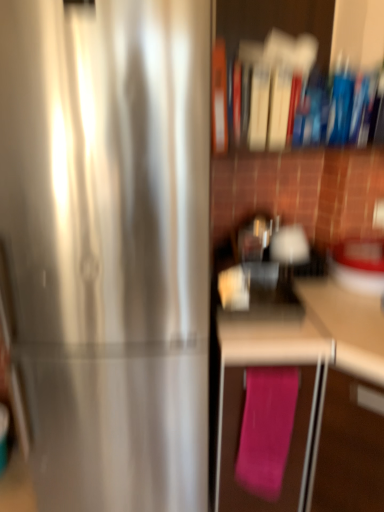
This screenshot has height=512, width=384. What do you see at coordinates (107, 248) in the screenshot? I see `satin silver refrigerator at left` at bounding box center [107, 248].

Image resolution: width=384 pixels, height=512 pixels. In order to click on pink fabric bath towel at lower right in this screenshot , I will do `click(266, 429)`.

Where is `satin silver refrigerator at left`? satin silver refrigerator at left is located at coordinates (107, 248).

Which object is wider, pink fabric bath towel at lower right or satin silver refrigerator at left?

satin silver refrigerator at left is wider.

Consider the image. Is pink fabric bath towel at lower right at the right side of satin silver refrigerator at left?

Indeed, pink fabric bath towel at lower right is positioned on the right side of satin silver refrigerator at left.

Are pink fabric bath towel at lower right and satin silver refrigerator at left beside each other?

pink fabric bath towel at lower right and satin silver refrigerator at left are clearly separated.

Which object is more forward, pink fabric bath towel at lower right or satin silver refrigerator at left?

satin silver refrigerator at left is closer to the camera.

Does pink fabric at lower right lie behind satin silver refrigerator at left?

No, pink fabric at lower right is in front of satin silver refrigerator at left.

Considering the sizes of objects pink fabric at lower right and satin silver refrigerator at left in the image provided, who is shorter, pink fabric at lower right or satin silver refrigerator at left?

pink fabric at lower right is shorter.

Based on the photo, from a real-world perspective, who is located lower, pink fabric at lower right or satin silver refrigerator at left?

pink fabric at lower right is physically lower.

Which is correct: pink fabric at lower right is inside satin silver refrigerator at left, or outside of it?

The correct answer is: outside.

Which is in front, satin silver refrigerator at left or pink fabric bath towel at lower right?

satin silver refrigerator at left is closer to the camera.

Considering the relative sizes of satin silver refrigerator at left and pink fabric bath towel at lower right in the image provided, is satin silver refrigerator at left taller than pink fabric bath towel at lower right?

Indeed, satin silver refrigerator at left has a greater height compared to pink fabric bath towel at lower right.

How far apart are satin silver refrigerator at left and pink fabric bath towel at lower right?

satin silver refrigerator at left and pink fabric bath towel at lower right are 15.99 inches apart from each other.

From a real-world perspective, which object stands above the other?

satin silver refrigerator at left is physically above.

Considering the sizes of pink fabric at lower right and pink fabric bath towel at lower right in the image, is pink fabric at lower right taller or shorter than pink fabric bath towel at lower right?

Considering their sizes, pink fabric at lower right has more height than pink fabric bath towel at lower right.

From the image's perspective, who appears lower, pink fabric at lower right or pink fabric bath towel at lower right?

pink fabric at lower right appears lower in the image.

From a real-world perspective, is pink fabric at lower right on top of pink fabric bath towel at lower right?

No, from a real-world perspective, pink fabric at lower right is not above pink fabric bath towel at lower right.

Is pink fabric at lower right not inside pink fabric bath towel at lower right?

pink fabric at lower right is positioned outside pink fabric bath towel at lower right.

Is pink fabric bath towel at lower right directly adjacent to pink fabric at lower right?

Absolutely, pink fabric bath towel at lower right is next to and touching pink fabric at lower right.

From the picture: Is pink fabric bath towel at lower right located outside pink fabric at lower right?

No, most part of pink fabric bath towel at lower right lies within pink fabric at lower right.

Is pink fabric bath towel at lower right facing towards pink fabric at lower right?

Yes, pink fabric bath towel at lower right is oriented towards pink fabric at lower right.

Is satin silver refrigerator at left shorter than pink fabric at lower right?

No.

Which of these two, satin silver refrigerator at left or pink fabric at lower right, is thinner?

satin silver refrigerator at left is thinner.

Is satin silver refrigerator at left inside the boundaries of pink fabric at lower right, or outside?

satin silver refrigerator at left lies outside pink fabric at lower right.

Which is farther from the camera, (54,443) or (330,390)?

The point (54,443) is farther.

This screenshot has width=384, height=512. Identify the location of bath towel located below the satin silver refrigerator at left (from the image's perspective). (266, 429).

Locate an element on the screen. cabinetry below the satin silver refrigerator at left (from a real-world perspective) is located at coordinates (291, 390).

Looking at the image, which one is located closer to pink fabric bath towel at lower right, pink fabric at lower right or satin silver refrigerator at left?

pink fabric at lower right lies closer to pink fabric bath towel at lower right than the other object.

Based on the photo, based on their spatial positions, is satin silver refrigerator at left or pink fabric at lower right closer to pink fabric bath towel at lower right?

The object closer to pink fabric bath towel at lower right is pink fabric at lower right.

Which object lies nearer to the anchor point satin silver refrigerator at left, pink fabric at lower right or pink fabric bath towel at lower right?

pink fabric at lower right.

When comparing their distances from satin silver refrigerator at left, does pink fabric bath towel at lower right or pink fabric at lower right seem closer?

Among the two, pink fabric at lower right is located nearer to satin silver refrigerator at left.

Looking at the image, which one is located further to pink fabric at lower right, satin silver refrigerator at left or pink fabric bath towel at lower right?

Based on the image, satin silver refrigerator at left appears to be further to pink fabric at lower right.

Based on their spatial positions, is pink fabric bath towel at lower right or satin silver refrigerator at left further from pink fabric at lower right?

satin silver refrigerator at left.

The width and height of the screenshot is (384, 512). Identify the location of bath towel between satin silver refrigerator at left and pink fabric at lower right in the horizontal direction. (266, 429).